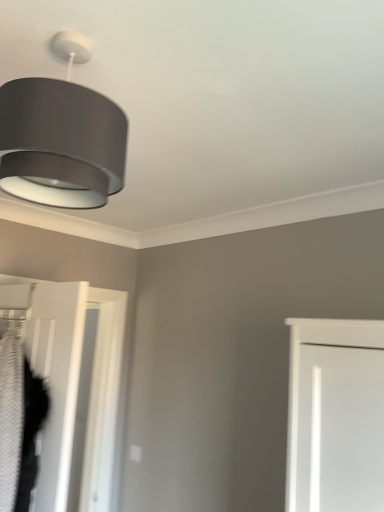
Where is `matte gray lampshade at upper left`? matte gray lampshade at upper left is located at coordinates (61, 137).

This screenshot has width=384, height=512. What do you see at coordinates (61, 137) in the screenshot?
I see `matte gray lampshade at upper left` at bounding box center [61, 137].

Describe the element at coordinates (74, 383) in the screenshot. I see `white textured door at lower left` at that location.

The height and width of the screenshot is (512, 384). I want to click on white textured door at lower left, so click(x=74, y=383).

Find the location of `matte gray lampshade at upper left`. matte gray lampshade at upper left is located at coordinates (61, 137).

Can you confirm if white textured door at lower left is positioned to the right of matte gray lampshade at upper left?

Incorrect, white textured door at lower left is not on the right side of matte gray lampshade at upper left.

In the image, is white textured door at lower left positioned in front of or behind matte gray lampshade at upper left?

In the image, white textured door at lower left appears behind matte gray lampshade at upper left.

Considering the positions of point (37, 357) and point (10, 92), is point (37, 357) closer or farther from the camera than point (10, 92)?

Point (37, 357) appears to be farther away from the viewer than point (10, 92).

From the image's perspective, does white textured door at lower left appear lower than matte gray lampshade at upper left?

Yes, from the image's perspective, white textured door at lower left is beneath matte gray lampshade at upper left.

Looking at this image, from a real-world perspective, is white textured door at lower left beneath matte gray lampshade at upper left?

Yes, from a real-world perspective, white textured door at lower left is under matte gray lampshade at upper left.

Is white textured door at lower left wider than matte gray lampshade at upper left?

In fact, white textured door at lower left might be narrower than matte gray lampshade at upper left.

Can you confirm if white textured door at lower left is shorter than matte gray lampshade at upper left?

In fact, white textured door at lower left may be taller than matte gray lampshade at upper left.

Looking at the image, does white textured door at lower left seem bigger or smaller compared to matte gray lampshade at upper left?

Clearly, white textured door at lower left is larger in size than matte gray lampshade at upper left.

Is white textured door at lower left not inside matte gray lampshade at upper left?

Indeed, white textured door at lower left is completely outside matte gray lampshade at upper left.

Does white textured door at lower left touch matte gray lampshade at upper left?

No, white textured door at lower left is not next to matte gray lampshade at upper left.

Is white textured door at lower left facing towards matte gray lampshade at upper left?

No, white textured door at lower left is not aimed at matte gray lampshade at upper left.

In order to click on door lying below the matte gray lampshade at upper left (from the image's perspective) in this screenshot , I will do `click(74, 383)`.

Is matte gray lampshade at upper left at the right side of white textured door at lower left?

Correct, you'll find matte gray lampshade at upper left to the right of white textured door at lower left.

Consider the image. Relative to white textured door at lower left, is matte gray lampshade at upper left in front or behind?

matte gray lampshade at upper left is in front of white textured door at lower left.

Which is closer, (53, 196) or (58, 482)?

Point (53, 196).

From the image's perspective, would you say matte gray lampshade at upper left is positioned over white textured door at lower left?

Yes.

From a real-world perspective, is matte gray lampshade at upper left positioned above or below white textured door at lower left?

matte gray lampshade at upper left is situated higher than white textured door at lower left in the real world.

Considering the sizes of objects matte gray lampshade at upper left and white textured door at lower left in the image provided, who is thinner, matte gray lampshade at upper left or white textured door at lower left?

Thinner between the two is white textured door at lower left.

Considering the relative sizes of matte gray lampshade at upper left and white textured door at lower left in the image provided, is matte gray lampshade at upper left taller than white textured door at lower left?

No, matte gray lampshade at upper left is not taller than white textured door at lower left.

Can you confirm if matte gray lampshade at upper left is smaller than white textured door at lower left?

Indeed, matte gray lampshade at upper left has a smaller size compared to white textured door at lower left.

Which is correct: matte gray lampshade at upper left is inside white textured door at lower left, or outside of it?

matte gray lampshade at upper left exists outside the volume of white textured door at lower left.

Would you consider matte gray lampshade at upper left to be distant from white textured door at lower left?

Yes, matte gray lampshade at upper left and white textured door at lower left are quite far apart.

Could you tell me if matte gray lampshade at upper left is facing white textured door at lower left?

No.

Find the location of `door below the matte gray lampshade at upper left (from the image's perspective)`. door below the matte gray lampshade at upper left (from the image's perspective) is located at coordinates (74, 383).

The height and width of the screenshot is (512, 384). In order to click on lamp to the right of white textured door at lower left in this screenshot , I will do `click(61, 137)`.

This screenshot has width=384, height=512. What are the coordinates of `lamp that appears in front of the white textured door at lower left` in the screenshot? It's located at (61, 137).